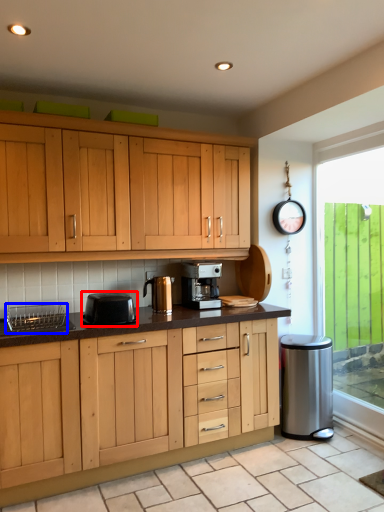
Question: Among these objects, which one is farthest to the camera, kitchen appliance (highlighted by a red box) or appliance (highlighted by a blue box)?

Choices:
 (A) kitchen appliance
 (B) appliance

Answer: (A)